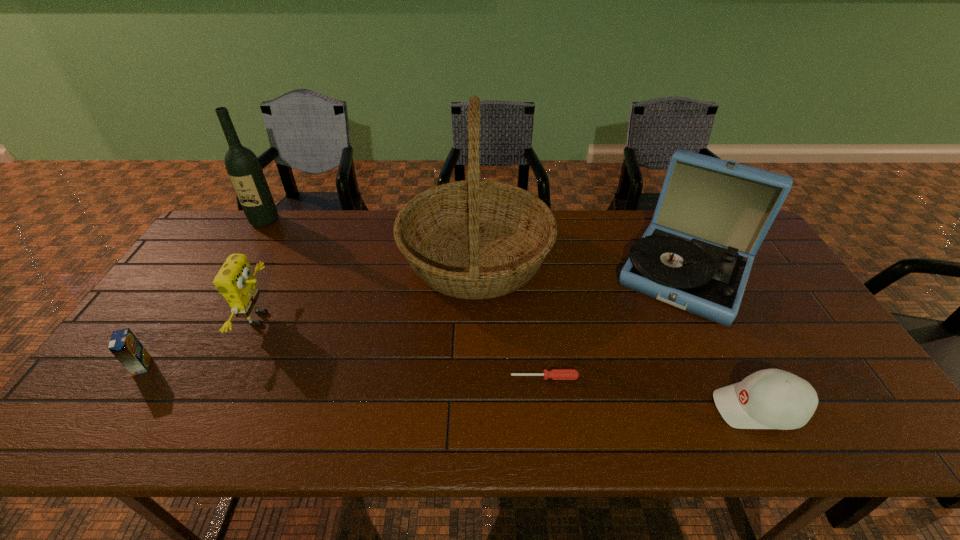
You are a GUI agent. You are given a task and a screenshot of the screen. Output one action in this format:
    pyautogui.click(x=<x>, y=<y>)
    Task: Click on the tallest object
    The height and width of the screenshot is (540, 960).
    Given the screenshot: What is the action you would take?
    pyautogui.click(x=474, y=239)

Find the location of a particular element. The height and width of the screenshot is (540, 960). wine bottle is located at coordinates (243, 167).

Locate an element on the screen. The image size is (960, 540). the sixth shortest object is located at coordinates (243, 167).

The image size is (960, 540). Identify the location of the third tallest object. (712, 215).

Identify the location of the third object from left to right. (235, 281).

Locate an element on the screen. the fourth tallest object is located at coordinates (235, 281).

Image resolution: width=960 pixels, height=540 pixels. Find the location of `orange_juice`. orange_juice is located at coordinates (124, 345).

The image size is (960, 540). What are the coordinates of `baseball cap` in the screenshot? It's located at (771, 398).

The image size is (960, 540). What are the coordinates of `the shortest object` in the screenshot? It's located at (556, 374).

The width and height of the screenshot is (960, 540). In order to click on free spot located 0.070m on the right of the tallest object in this screenshot , I will do `click(574, 258)`.